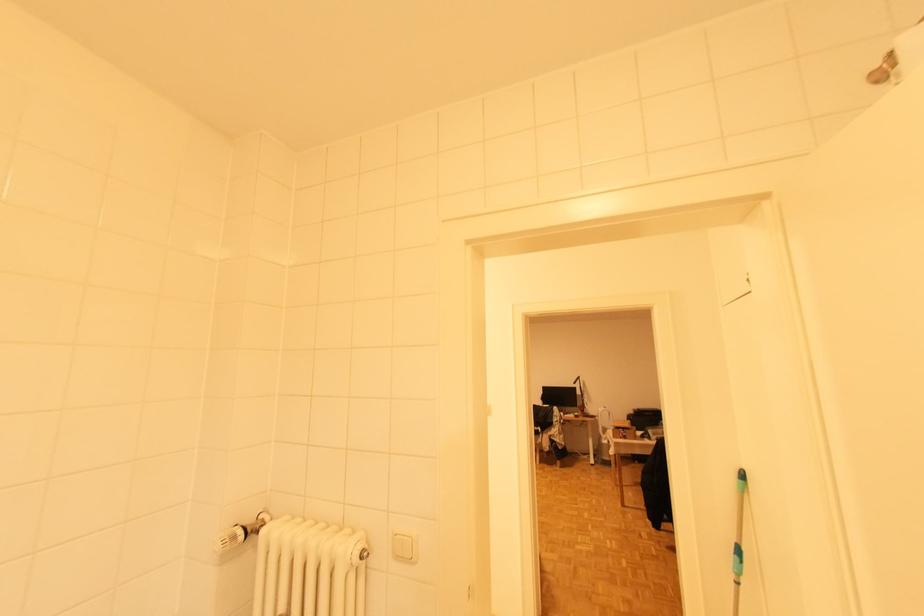
Where is `white light switch`? This screenshot has height=616, width=924. white light switch is located at coordinates 403,546.